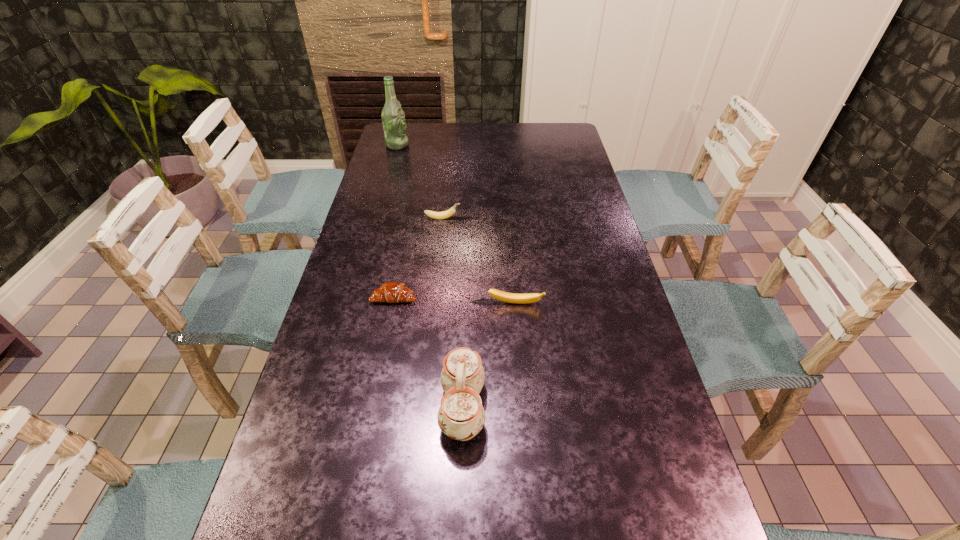
Find the location of `free space located 0.270m by the handle of the chinaware`. free space located 0.270m by the handle of the chinaware is located at coordinates (605, 407).

You are a GUI agent. You are given a task and a screenshot of the screen. Output one action in this format:
    pyautogui.click(x=<x>, y=<y>)
    Task: Click on the vacant point located 0.150m at the stem of the farther banana
    This screenshot has height=540, width=960.
    Given the screenshot: What is the action you would take?
    pyautogui.click(x=505, y=218)

Identify the location of blank area located 0.150m at the stem of the nearer banana. Image resolution: width=960 pixels, height=540 pixels. (519, 353).

The width and height of the screenshot is (960, 540). What are the coordinates of `vacant area situated on the right of the shortest object` in the screenshot? It's located at (482, 298).

The image size is (960, 540). Find the location of `object located in the far edge section of the desktop`. object located in the far edge section of the desktop is located at coordinates (393, 117).

This screenshot has width=960, height=540. I want to click on beer bottle that is at the left edge, so click(393, 117).

Locate an element on the screen. crescent roll that is at the left edge is located at coordinates (391, 292).

Where is `object present at the far left corner`? This screenshot has height=540, width=960. object present at the far left corner is located at coordinates (393, 117).

This screenshot has height=540, width=960. What are the coordinates of `vacant area at the far edge` in the screenshot? It's located at (453, 129).

Find the location of `free space at the left edge`. free space at the left edge is located at coordinates (390, 170).